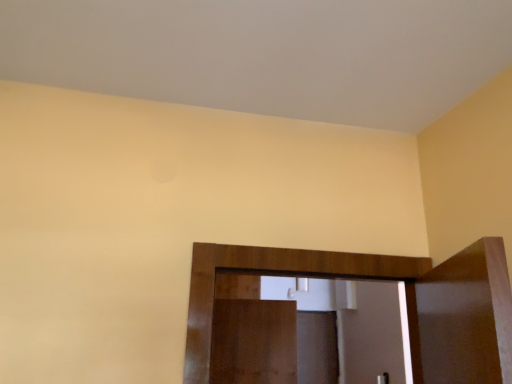
Describe the element at coordinates (317, 347) in the screenshot. I see `transparent glass screen door at center` at that location.

You are a GUI agent. You are given a task and a screenshot of the screen. Output one action in this format:
    pyautogui.click(x=<x>, y=<y>)
    Task: Click on the transparent glass screen door at center
    The height and width of the screenshot is (384, 512).
    Given the screenshot: What is the action you would take?
    pyautogui.click(x=317, y=347)

Find the location of `transparent glass screen door at center`. transparent glass screen door at center is located at coordinates (317, 347).